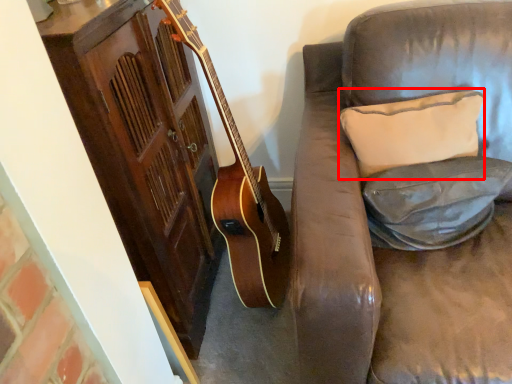
Question: From the image's perspective, where is pillow (annotated by the red box) located relative to pillow?

Choices:
 (A) below
 (B) above

Answer: (B)